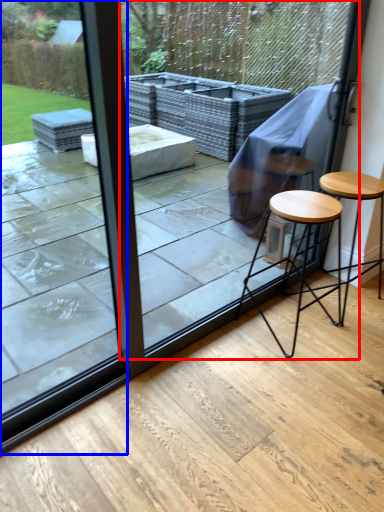
Question: Which object appears closest to the camera in this image, screen door (highlighted by a red box) or glass door (highlighted by a blue box)?

Choices:
 (A) screen door
 (B) glass door

Answer: (B)